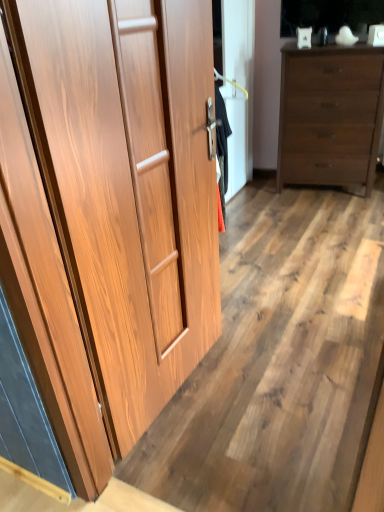
You are a GUI agent. You are given a task and a screenshot of the screen. Output one action in this format:
    pyautogui.click(x=<x>, y=<y>)
    Task: Click on the vacant area that lies in front of wooden cupboard at left
    
    Given the screenshot: What is the action you would take?
    pyautogui.click(x=213, y=446)